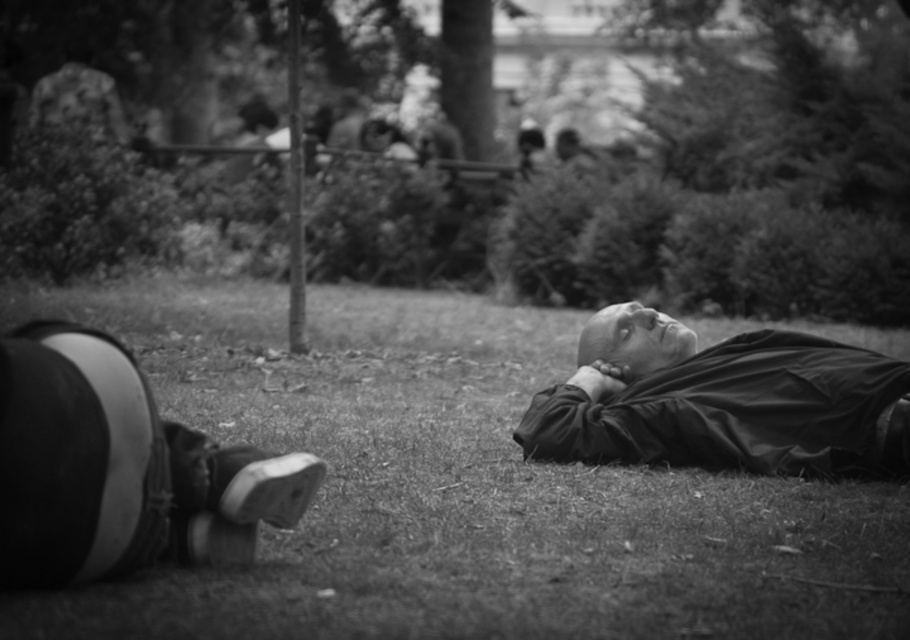
The image size is (910, 640). What are the coordinates of `grassy lawn at center` in the screenshot? It's located at (457, 488).

Based on the photo, can you confirm if grassy lawn at center is smaller than smooth black jacket at center?

No, grassy lawn at center is not smaller than smooth black jacket at center.

Is point (402, 524) farther from viewer compared to point (599, 323)?

No, it is in front of (599, 323).

Locate an element on the screen. grassy lawn at center is located at coordinates (457, 488).